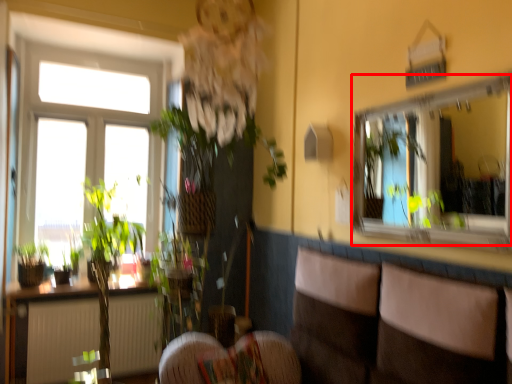
Question: Where is mirror (annotated by the red box) located in relation to couch in the image?

Choices:
 (A) right
 (B) left

Answer: (A)